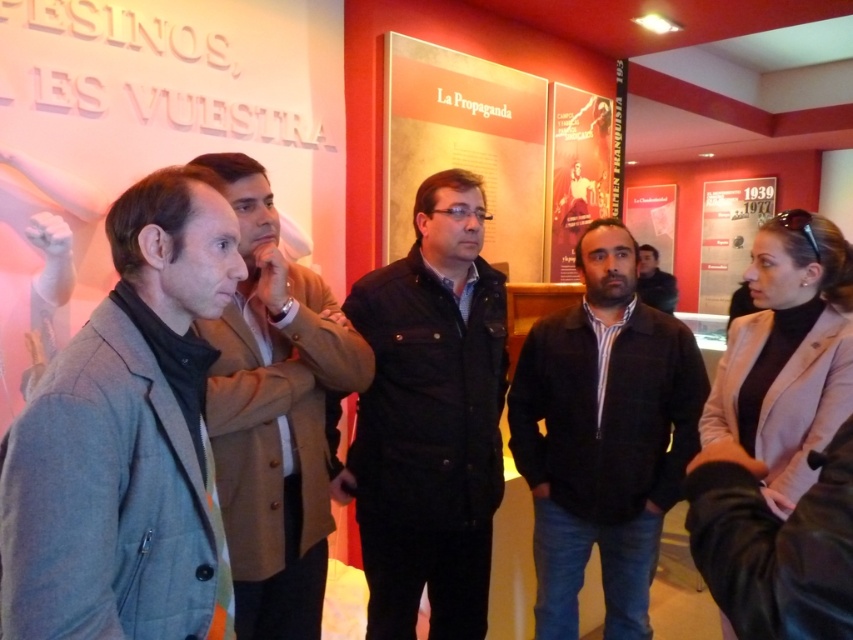
In the scene shown: Between light brown leather jacket at left and matte red poster at upper right, which one is positioned lower?

Positioned lower is light brown leather jacket at left.

From the picture: Is light brown leather jacket at left bigger than matte red poster at upper right?

No.

At what (x,y) coordinates should I click in order to perform the action: click on light brown leather jacket at left. Please return your answer as a coordinate pair (x, y). The image size is (853, 640). Looking at the image, I should click on (276, 416).

In the scene shown: Does dark blue jeans at center appear on the left side of matte red poster at upper right?

Correct, you'll find dark blue jeans at center to the left of matte red poster at upper right.

Who is more distant from viewer, (612, 488) or (747, 262)?

Positioned behind is point (747, 262).

This screenshot has height=640, width=853. In order to click on dark blue jeans at center in this screenshot , I will do `click(602, 435)`.

Which of these two, dark brown leather jacket at center or matte white poster at upper right, stands taller?

dark brown leather jacket at center is taller.

Between dark brown leather jacket at center and matte white poster at upper right, which one is positioned lower?

dark brown leather jacket at center

Is point (456, 467) farther from camera compared to point (643, 230)?

No, (456, 467) is in front of (643, 230).

You are a GUI agent. You are given a task and a screenshot of the screen. Output one action in this format:
    pyautogui.click(x=<x>, y=<y>)
    Task: Click on the dark brown leather jacket at center
    The height and width of the screenshot is (640, 853).
    Given the screenshot: What is the action you would take?
    pyautogui.click(x=430, y=419)